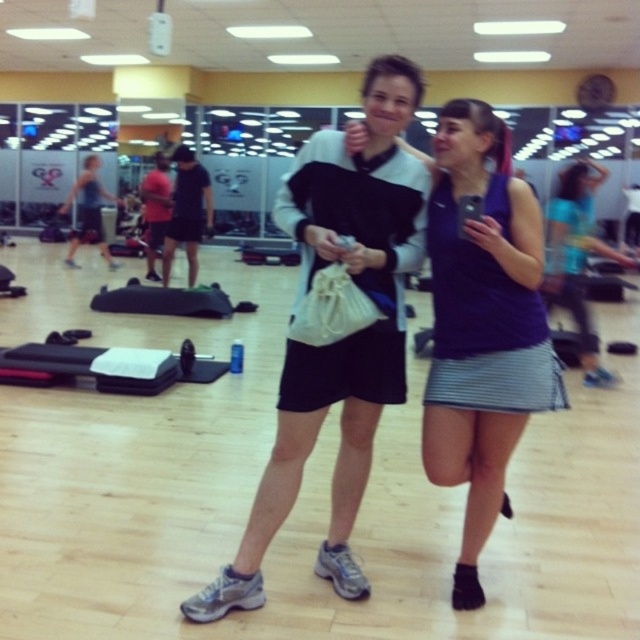
Question: Does blue jersey at center have a greater width compared to purple fabric tank top at center?

Choices:
 (A) yes
 (B) no

Answer: (B)

Question: Which point is farther to the camera?

Choices:
 (A) (595, 164)
 (B) (476, 536)
 (C) (400, 294)

Answer: (A)

Question: Is blue jersey at center further to camera compared to purple fabric tank top at center?

Choices:
 (A) no
 (B) yes

Answer: (A)

Question: Which object appears farthest from the camera in this image?

Choices:
 (A) white matte jacket at center
 (B) purple fabric tank top at center
 (C) blue jersey at center

Answer: (B)

Question: Which point is closer to the camera?

Choices:
 (A) (531, 257)
 (B) (346, 161)
 (C) (580, 358)

Answer: (A)

Question: Can you confirm if white matte jacket at center is smaller than blue jersey at center?

Choices:
 (A) yes
 (B) no

Answer: (B)